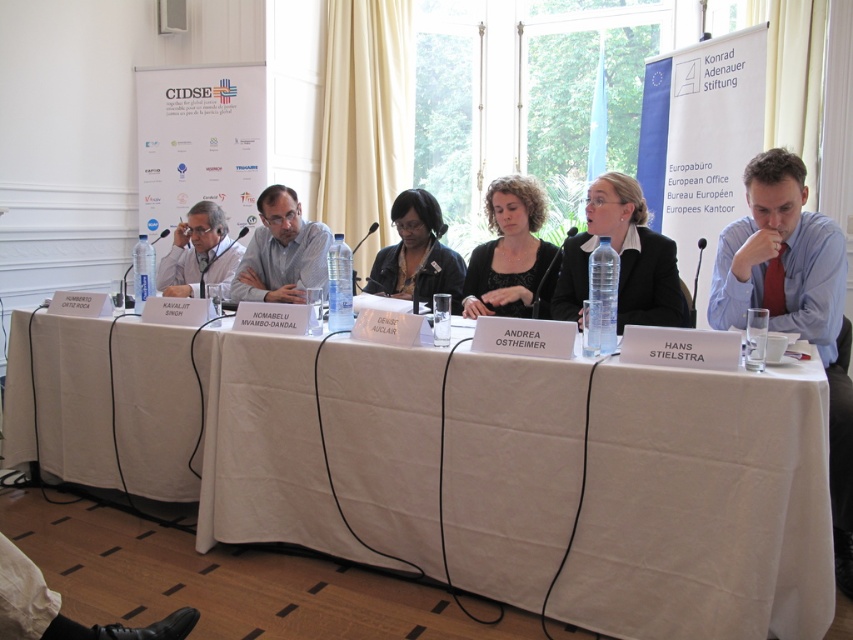
Looking at this image, you are a photographer at the back of the room and want to take a photo of the white fabric table at center and the black matte shirt at center. Which object should be in focus to ensure both are clearly visible?

The white fabric table at center is in front of the black matte shirt at center, so focusing on the white fabric table at center will ensure both are in focus.

You are a photographer at the event and need to capture a photo that includes both the gray striped shirt at center and the matte gray suit at left. Given that your camera has a limited focus range, which of the two should you ensure is in focus first to maximize the chances of both being clear?

The gray striped shirt at center is smaller than the matte gray suit at left, so you should focus on the matte gray suit at left first to ensure both are in focus.